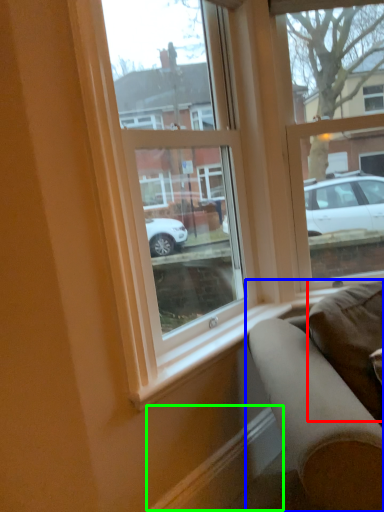
Question: Estimate the real-world distances between objects in this image. Which object is farther from pillow (highlighted by a red box), studio couch (highlighted by a blue box) or curb (highlighted by a green box)?

Choices:
 (A) studio couch
 (B) curb

Answer: (B)